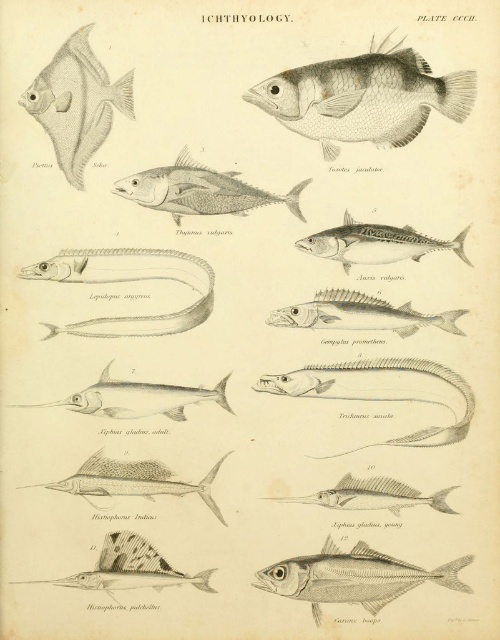
You are an ichthyologist examining the illustration. You notice two fish in the upper section of the image. The first is a translucent silver fish at upper left, and the second is a silver metallic fish at center. Based on their positions in the illustration, which fish appears closer to the viewer?

The translucent silver fish at upper left appears closer to the viewer because it is positioned in front of the silver metallic fish at center.

You are an ichthyologist examining the illustration. You need to identify the fish that is larger between the gray matte fish at upper center and the grayish metallic fish at center. Which one is larger?

The gray matte fish at upper center is bigger than the grayish metallic fish at center, so the gray matte fish at upper center is larger.

You are standing 1 meter away from a point marked at coordinates point [368,365] in the image. Is the point closer to you or farther away than your current position?

The distance of point [368,365] from viewer is 1.17 meters, so the point is farther away than your current position of 1 meter.